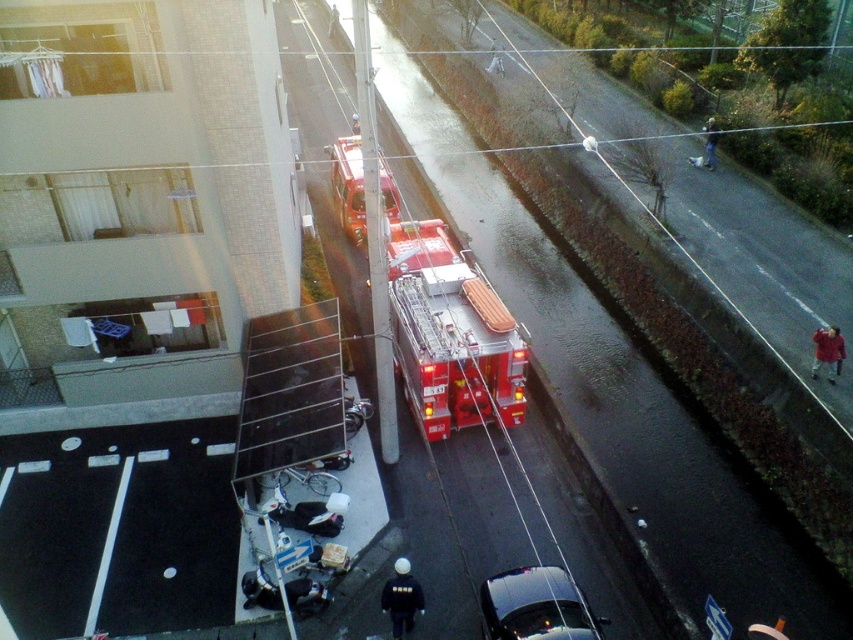
You are a delivery driver who needs to park your van in the parking lot near the beige building. There is a shiny red fire truck at center and a shiny black car at lower center blocking the entrance. Can you safely maneuver your van between them without hitting either vehicle?

The shiny red fire truck at center is 21.75 feet away from the shiny black car at lower center. Since the distance between them is sufficient for a van to pass through safely, you can maneuver your van between them without hitting either vehicle.

You are a delivery person who needs to park your van in the parking lot near the beige building. The van is 2 meters tall. There is a shiny red fire truck at center and a shiny black car at lower center in the way. Can you drive through the space between them?

The shiny red fire truck at center is much taller than the shiny black car at lower center. Since the fire truck is taller, it might have a higher clearance. However, the van is 2 meters tall, and without knowing the exact height of the space between them, it is uncertain if it can pass. Consider checking the height restrictions or finding an alternative route.